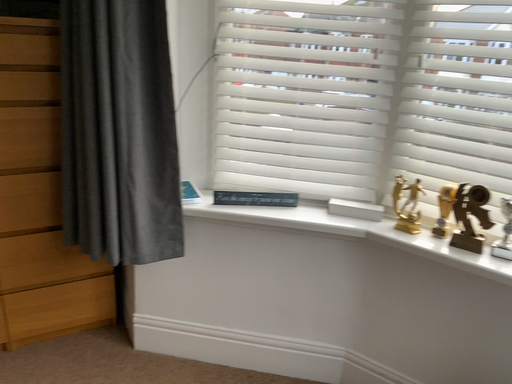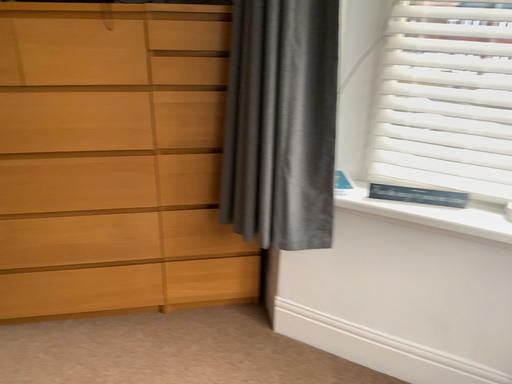
Question: How did the camera likely rotate when shooting the video?

Choices:
 (A) rotated left
 (B) rotated right

Answer: (A)